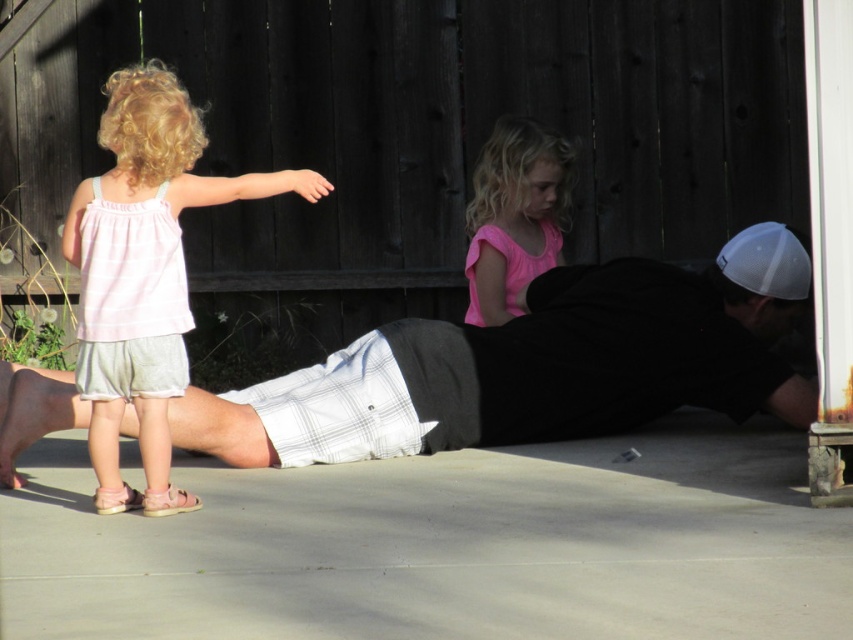
Question: Is pink fabric shirt at center positioned behind pink fabric sandal at lower left?

Choices:
 (A) yes
 (B) no

Answer: (A)

Question: Based on their relative distances, which object is farther from the pink fabric shirt at center?

Choices:
 (A) pink fabric sandal at lower left
 (B) white plaid shirt at center

Answer: (A)

Question: Which object is the closest to the pink fabric sandal at lower left?

Choices:
 (A) white plaid shirt at center
 (B) pink fabric shirt at center
 (C) pink fabric dress at left

Answer: (C)

Question: Which object appears closest to the camera in this image?

Choices:
 (A) white plaid shirt at center
 (B) pink fabric sandal at lower left
 (C) pink fabric dress at left

Answer: (C)

Question: Does white plaid shirt at center have a smaller size compared to pink fabric shirt at center?

Choices:
 (A) no
 (B) yes

Answer: (A)

Question: Can you confirm if white plaid shirt at center is positioned to the left of pink fabric shirt at center?

Choices:
 (A) no
 (B) yes

Answer: (B)